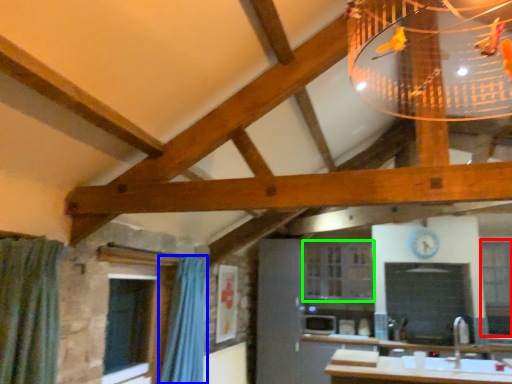
Question: Which object is positioned closest to window (highlighted by a red box)? Select from shower curtain (highlighted by a blue box) and window (highlighted by a green box).

Choices:
 (A) shower curtain
 (B) window

Answer: (B)